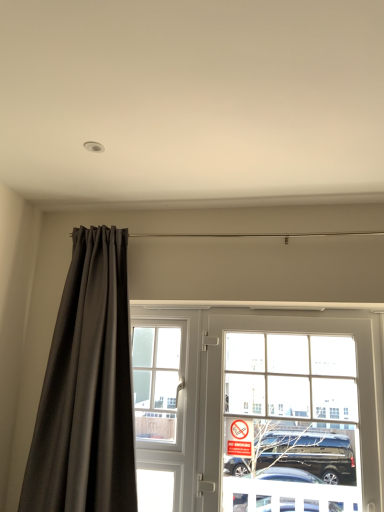
Locate an element on the screen. clear glass door at center is located at coordinates (293, 422).

What is the approximate height of clear glass door at center?

1.05 meters.

What do you see at coordinates (87, 389) in the screenshot?
I see `matte black curtain at left` at bounding box center [87, 389].

Image resolution: width=384 pixels, height=512 pixels. In order to click on red plastic sign at center in this screenshot , I will do `click(239, 437)`.

From the picture: Are red plastic sign at center and clear glass window at center located far from each other?

red plastic sign at center is near clear glass window at center, not far away.

Is point (234, 454) farther from camera compared to point (179, 327)?

That is False.

Between red plastic sign at center and clear glass window at center, which one has more height?

clear glass window at center is taller.

Visually, is matte black curtain at left positioned to the left or to the right of clear glass door at center?

matte black curtain at left is positioned on clear glass door at center's left side.

From the image's perspective, between matte black curtain at left and clear glass door at center, which one is located above?

matte black curtain at left is shown above in the image.

From the picture: Are matte black curtain at left and clear glass door at center located far from each other?

matte black curtain at left is actually quite close to clear glass door at center.

Could you tell me if matte black curtain at left is turned towards clear glass door at center?

No, matte black curtain at left is not oriented towards clear glass door at center.

Could you tell me if matte black curtain at left is facing red plastic sign at center?

No, matte black curtain at left does not turn towards red plastic sign at center.

Which is in front, point (104, 445) or point (251, 447)?

The point (104, 445) is in front.

Based on the photo, how distant is matte black curtain at left from red plastic sign at center?

matte black curtain at left and red plastic sign at center are 33.31 inches apart.

Is matte black curtain at left positioned behind red plastic sign at center?

No.

From the image's perspective, is matte black curtain at left located above clear glass window at center?

Yes, from the image's perspective, matte black curtain at left is on top of clear glass window at center.

From the picture: Which is in front, matte black curtain at left or clear glass window at center?

matte black curtain at left is closer to the camera.

How far apart are matte black curtain at left and clear glass window at center?

A distance of 18.35 inches exists between matte black curtain at left and clear glass window at center.

Can you confirm if matte black curtain at left is shorter than clear glass window at center?

In fact, matte black curtain at left may be taller than clear glass window at center.

Does clear glass window at center lie behind red plastic sign at center?

Yes, clear glass window at center is further from the viewer.

From the image's perspective, which is below, clear glass window at center or red plastic sign at center?

red plastic sign at center, from the image's perspective.

From a real-world perspective, is clear glass window at center physically above red plastic sign at center?

Yes, from a real-world perspective, clear glass window at center is over red plastic sign at center

Considering the sizes of objects clear glass door at center and clear glass window at center in the image provided, who is thinner, clear glass door at center or clear glass window at center?

Result: clear glass window at center.

Which is more to the right, clear glass door at center or clear glass window at center?

clear glass door at center is more to the right.

From the image's perspective, between clear glass door at center and clear glass window at center, who is located below?

From the image's view, clear glass door at center is below.

Between red plastic sign at center and matte black curtain at left, which one appears on the right side from the viewer's perspective?

From the viewer's perspective, red plastic sign at center appears more on the right side.

Does point (227, 428) appear closer or farther from the camera than point (75, 449)?

Clearly, point (227, 428) is more distant from the camera than point (75, 449).

Is red plastic sign at center far away from matte black curtain at left?

No, there isn't a large distance between red plastic sign at center and matte black curtain at left.

Locate an element on the screen. The height and width of the screenshot is (512, 384). window above the red plastic sign at center (from the image's perspective) is located at coordinates (158, 382).

Locate an element on the screen. bay window that is below the matte black curtain at left (from the image's perspective) is located at coordinates point(293,422).

Estimate the real-world distances between objects in this image. Which object is closer to red plastic sign at center, matte black curtain at left or clear glass window at center?

clear glass window at center lies closer to red plastic sign at center than the other object.

From the image, which object appears to be nearer to matte black curtain at left, clear glass door at center or red plastic sign at center?

red plastic sign at center is positioned closer to the anchor matte black curtain at left.

From the picture: Estimate the real-world distances between objects in this image. Which object is closer to clear glass door at center, red plastic sign at center or clear glass window at center?

The object closer to clear glass door at center is red plastic sign at center.

Based on the photo, based on their spatial positions, is red plastic sign at center or clear glass door at center further from clear glass window at center?

Among the two, clear glass door at center is located further to clear glass window at center.

When comparing their distances from clear glass window at center, does matte black curtain at left or clear glass door at center seem further?

clear glass door at center.

From the image, which object appears to be nearer to clear glass door at center, clear glass window at center or matte black curtain at left?

Among the two, clear glass window at center is located nearer to clear glass door at center.

Estimate the real-world distances between objects in this image. Which object is closer to red plastic sign at center, clear glass window at center or matte black curtain at left?

clear glass window at center.

From the image, which object appears to be farther from clear glass door at center, red plastic sign at center or matte black curtain at left?

matte black curtain at left lies further to clear glass door at center than the other object.

Locate an element on the screen. This screenshot has height=512, width=384. parking sign between clear glass window at center and clear glass door at center is located at coordinates (239, 437).

Identify the location of window between matte black curtain at left and red plastic sign at center. (158, 382).

Find the location of a particular element. This screenshot has width=384, height=512. parking sign between matte black curtain at left and clear glass door at center in the horizontal direction is located at coordinates (239, 437).

You are a GUI agent. You are given a task and a screenshot of the screen. Output one action in this format:
    pyautogui.click(x=<x>, y=<y>)
    Task: Click on the window situated between matte black curtain at left and clear glass door at center from left to right
    
    Given the screenshot: What is the action you would take?
    pyautogui.click(x=158, y=382)